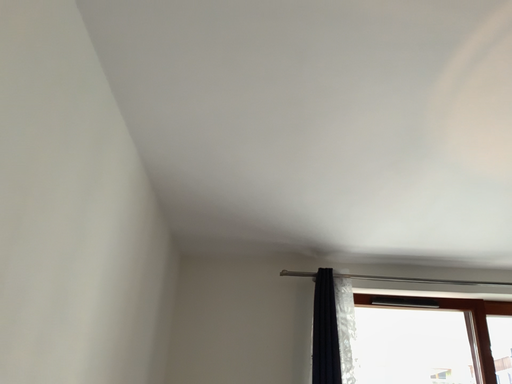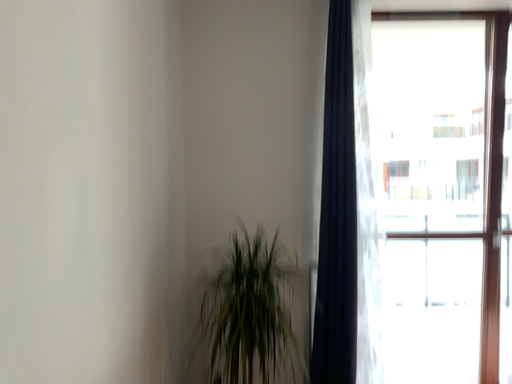
Question: Which way did the camera rotate in the video?

Choices:
 (A) rotated downward
 (B) rotated upward

Answer: (A)